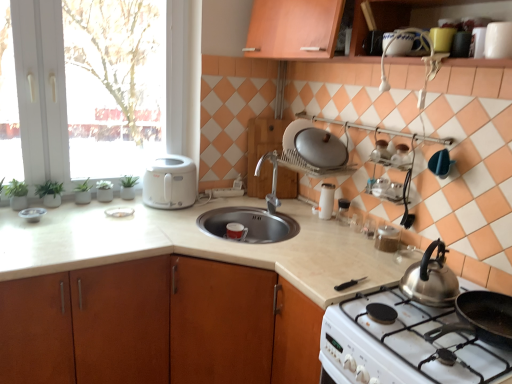
This screenshot has height=384, width=512. Identify the location of free space in front of white glossy window at upper left. (81, 221).